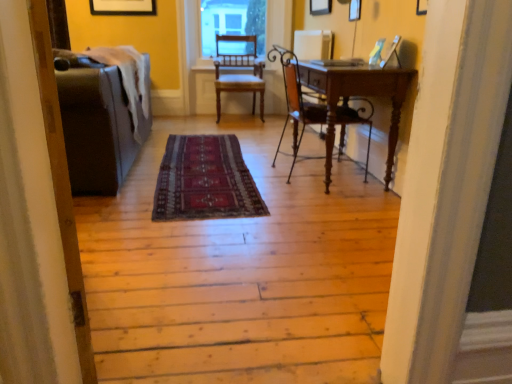
Question: From the image's perspective, is wooden chair at center, arranged as the second chair when ordered from the bottom, located above or below matte gray couch at left?

Choices:
 (A) above
 (B) below

Answer: (A)

Question: Relative to matte gray couch at left, is wooden chair at center, which ranks as the second chair in right-to-left order, in front or behind?

Choices:
 (A) front
 (B) behind

Answer: (B)

Question: Which object is the closest to the clear glass window screen at upper center?

Choices:
 (A) matte gray couch at left
 (B) wooden chair at center, which is counted as the 2th chair, starting from the back
 (C) wooden chair at center, which is the first chair from back to front
 (D) dark red woven rug at center
 (E) matte black couch at left

Answer: (C)

Question: Estimate the real-world distances between objects in this image. Which object is farther from the matte black couch at left?

Choices:
 (A) clear glass window screen at upper center
 (B) matte gray couch at left
 (C) dark red woven rug at center
 (D) wooden chair at center, the 1th chair in the bottom-to-top sequence
 (E) wooden chair at center, arranged as the second chair when viewed from the front

Answer: (A)